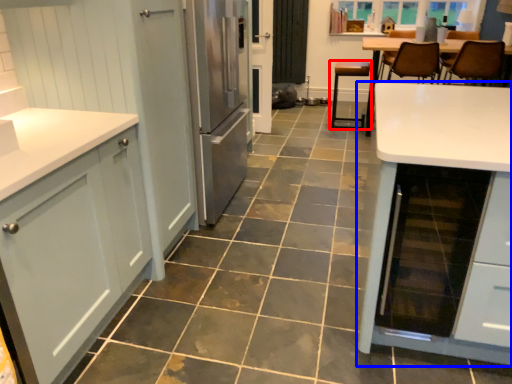
Question: Which object is closer to the camera taking this photo, chair (highlighted by a red box) or table (highlighted by a blue box)?

Choices:
 (A) chair
 (B) table

Answer: (B)